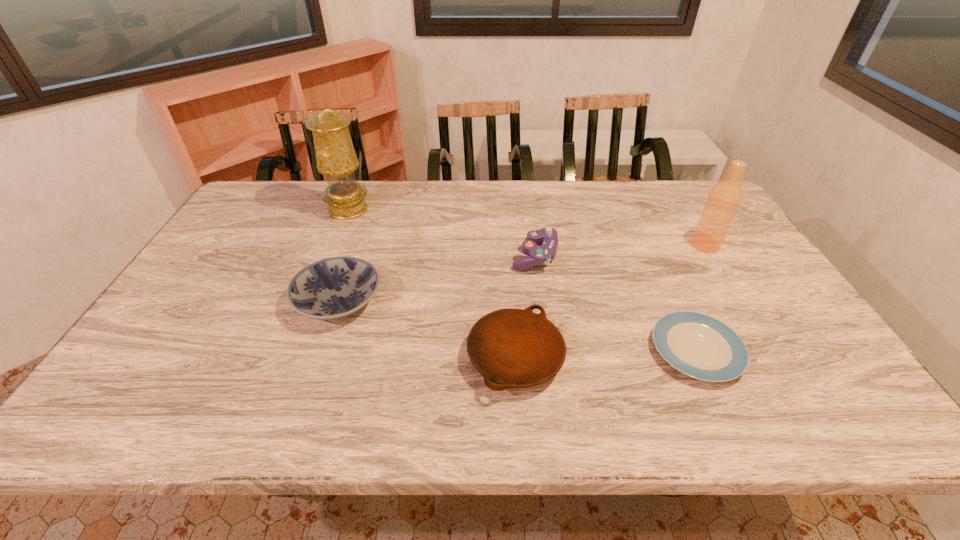
Locate an element on the screen. This screenshot has height=540, width=960. blank area at the right edge is located at coordinates (733, 300).

I want to click on free space at the far left corner of the desktop, so click(252, 213).

At what (x,y) coordinates should I click in order to perform the action: click on vacant space at the near left corner of the desktop. Please return your answer as a coordinate pair (x, y). This screenshot has height=540, width=960. Looking at the image, I should click on (152, 422).

Where is `free space between the control and the leftmost plate`? The image size is (960, 540). free space between the control and the leftmost plate is located at coordinates (437, 278).

Find the location of a particular element. free space between the leftmost plate and the fifth shortest object is located at coordinates (522, 273).

Identify the location of unoccupied area between the second plate from right to left and the oil lamp. The width and height of the screenshot is (960, 540). (432, 284).

You are a GUI agent. You are given a task and a screenshot of the screen. Output one action in this format:
    pyautogui.click(x=<x>, y=<y>)
    Task: Click on the unoccupied area between the fourth shortest object and the oil lamp
    
    Given the screenshot: What is the action you would take?
    pyautogui.click(x=442, y=233)

Locate an element on the screen. This screenshot has width=960, height=540. vacant point located between the control and the rightmost object is located at coordinates (620, 251).

Find the location of a particular element. The height and width of the screenshot is (540, 960). unoccupied position between the rightmost object and the second object from right to left is located at coordinates (701, 298).

Where is `empty location between the second plate from left to right and the rightmost plate`? The image size is (960, 540). empty location between the second plate from left to right and the rightmost plate is located at coordinates (606, 354).